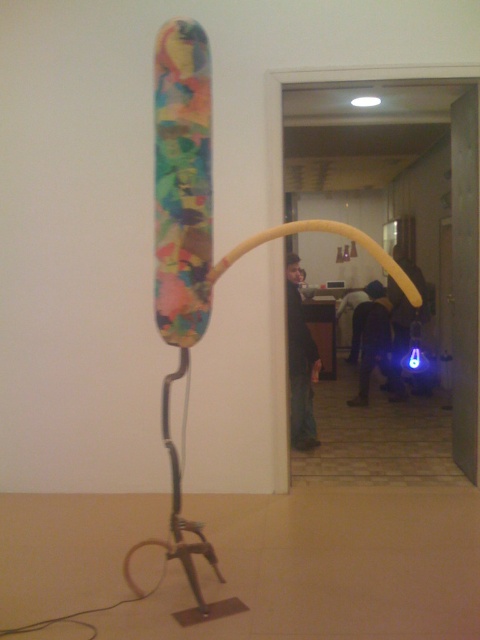
Which is behind, point (307, 406) or point (383, 342)?

Positioned behind is point (383, 342).

How much distance is there between dark blue jeans at center and dark fabric jacket at center?

A distance of 1.73 meters exists between dark blue jeans at center and dark fabric jacket at center.

Describe the element at coordinates (300, 362) in the screenshot. The width and height of the screenshot is (480, 640). I see `dark blue jeans at center` at that location.

Where is `dark blue jeans at center`? Image resolution: width=480 pixels, height=640 pixels. dark blue jeans at center is located at coordinates (300, 362).

Who is positioned more to the left, dark fabric jacket at center or blue led light at center?

From the viewer's perspective, dark fabric jacket at center appears more on the left side.

Between point (364, 397) and point (392, 289), which one is positioned in front?

Positioned in front is point (364, 397).

Image resolution: width=480 pixels, height=640 pixels. Identify the location of dark fabric jacket at center. (370, 339).

Can you confirm if dark blue jeans at center is thinner than blue led light at center?

Yes.

Is dark blue jeans at center closer to camera compared to blue led light at center?

Yes, it is.

Locate an element on the screen. dark blue jeans at center is located at coordinates (300, 362).

The width and height of the screenshot is (480, 640). In order to click on dark blue jeans at center in this screenshot , I will do `click(300, 362)`.